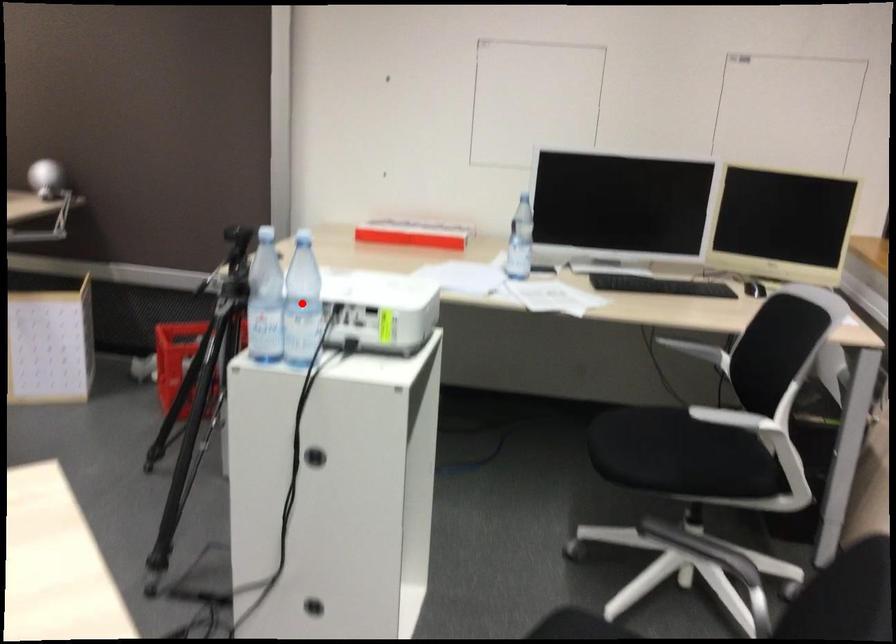
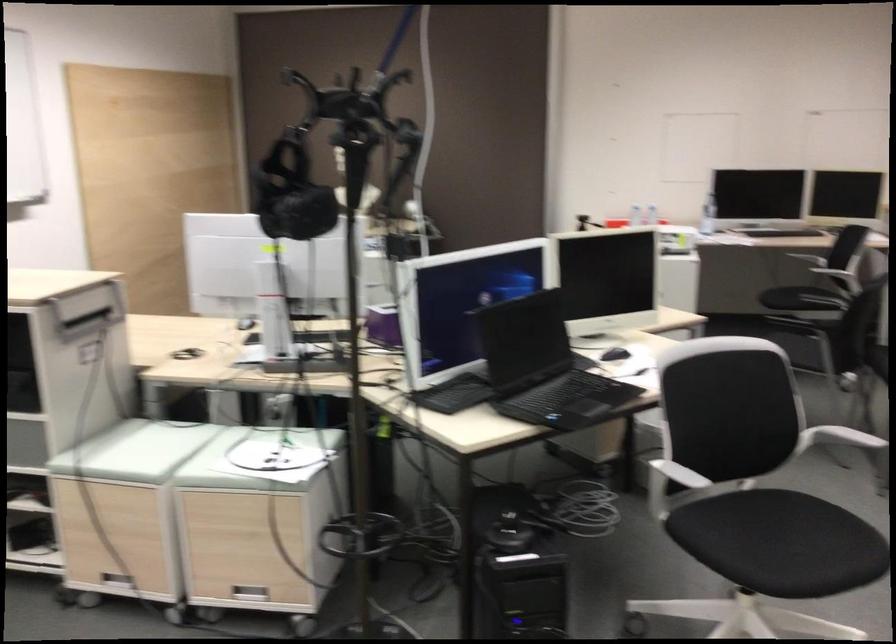
Question: I am providing you with two images of the same scene from different viewpoints. A red point is marked on the first image. Can you still see the location of the red point in image 2?

Choices:
 (A) Yes
 (B) No

Answer: (B)